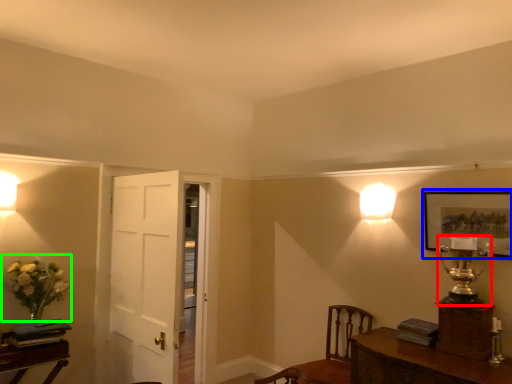
Question: Which object is positioned farthest from table lamp (highlighted by a red box)? Select from picture frame (highlighted by a blue box) and floral arrangement (highlighted by a green box).

Choices:
 (A) picture frame
 (B) floral arrangement

Answer: (B)